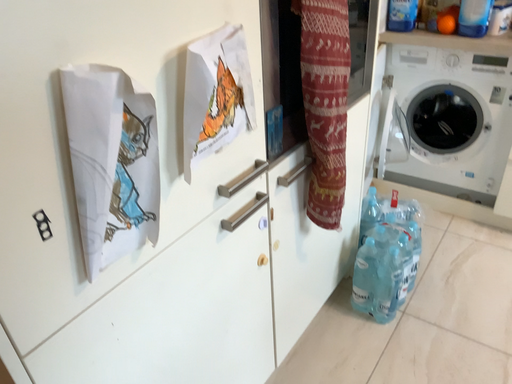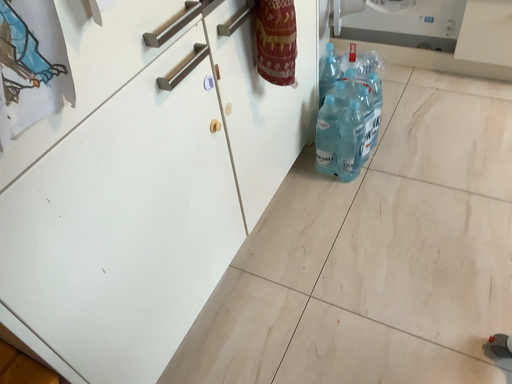
Question: Which way did the camera rotate in the video?

Choices:
 (A) rotated upward
 (B) rotated downward

Answer: (B)